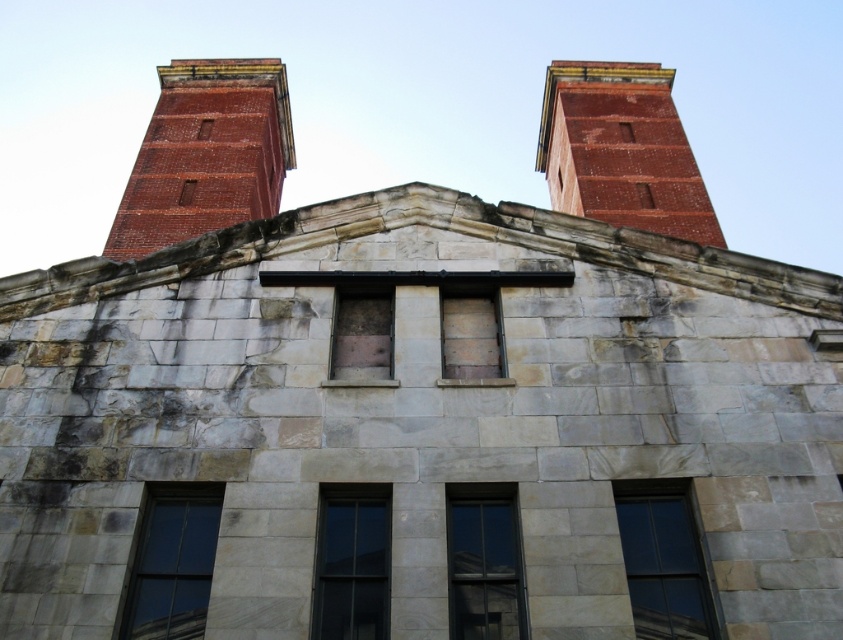
You are an architect assessing the building facade. You need to determine which object, the brick tower at upper left or the brown wooden window at center, has a greater height. Based on the scene description, which one is taller?

The brick tower at upper left is taller than the brown wooden window at center according to the description.

You are standing in front of the building and want to determine which of the two points, point (211, 72) or point (384, 355), is closer to you. Based on the building facade described, which point is nearer?

Point (211, 72) is further to the viewer than point (384, 355), so the closer point to you is point (384, 355).